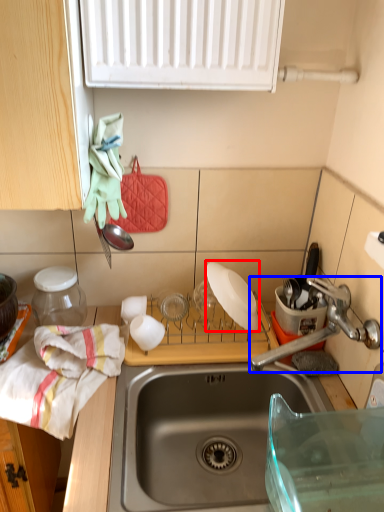
Question: Which object is closer to the camera taking this photo, appliance (highlighted by a red box) or tap (highlighted by a blue box)?

Choices:
 (A) appliance
 (B) tap

Answer: (B)